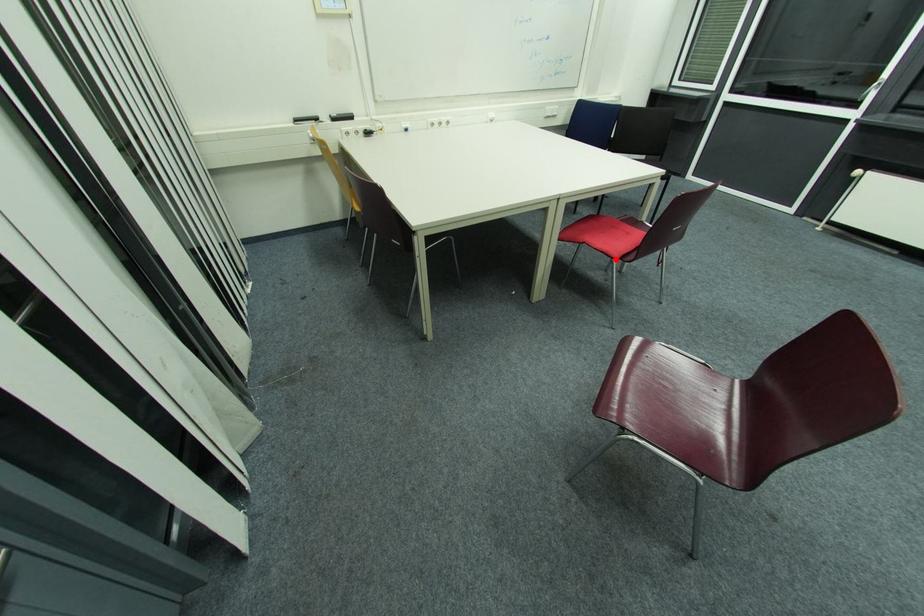
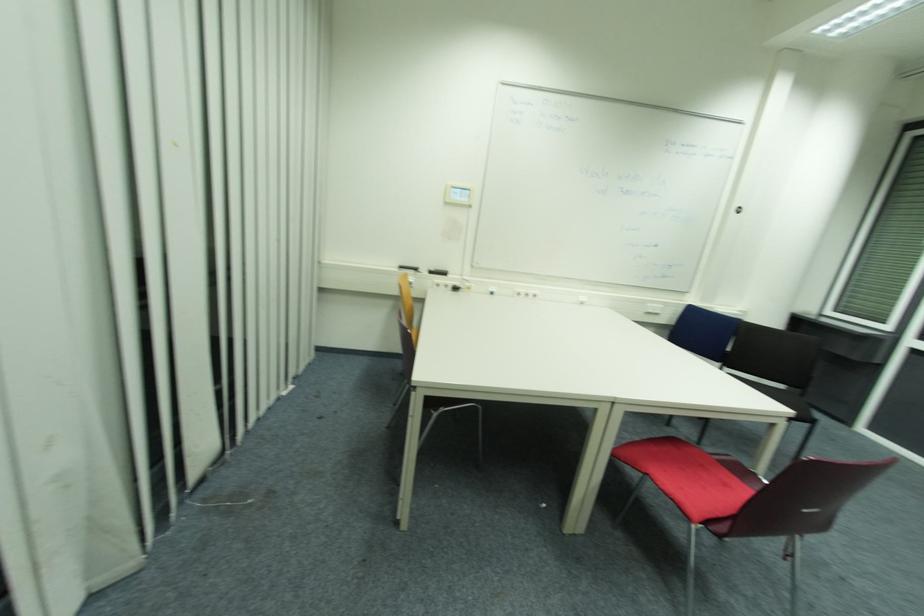
Question: I am providing you with two images of the same scene from different viewpoints. Given a red point in image1, look at the same physical point in image2. Is it:

Choices:
 (A) Closer to the viewpoint
 (B) Farther from the viewpoint

Answer: (B)